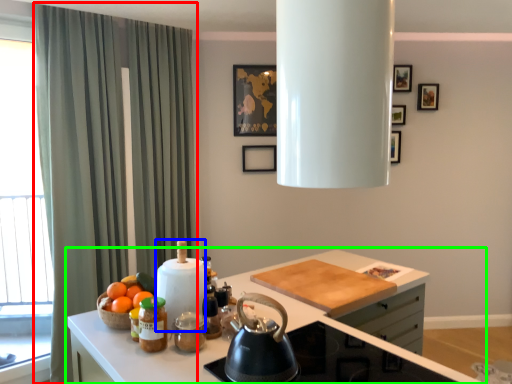
Question: Estimate the real-world distances between objects in this image. Which object is farther from curtain (highlighted by a red box), appliance (highlighted by a blue box) or countertop (highlighted by a green box)?

Choices:
 (A) appliance
 (B) countertop

Answer: (A)